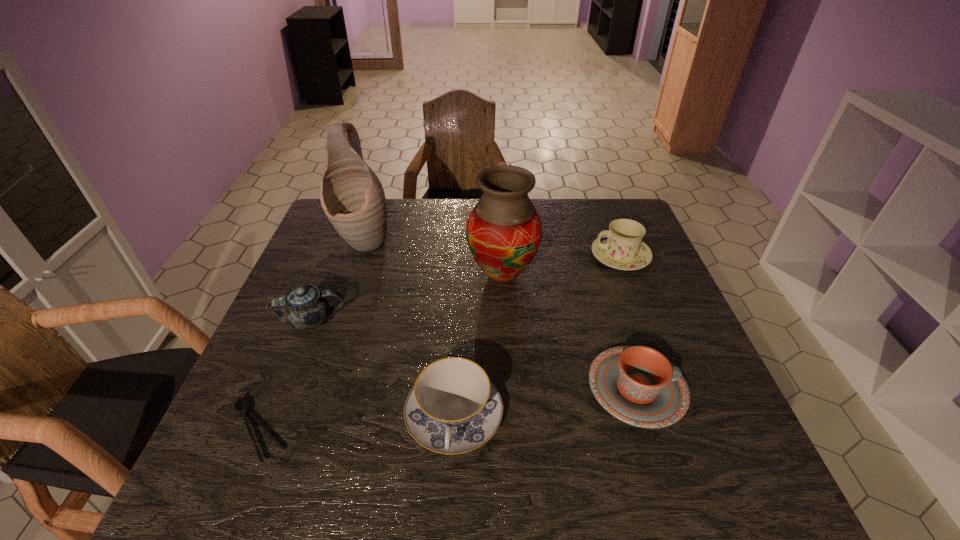
Where is `tongs at the near edge`? Image resolution: width=960 pixels, height=540 pixels. tongs at the near edge is located at coordinates (245, 412).

Find the location of a particular element. The height and width of the screenshot is (540, 960). pitcher located at the left edge is located at coordinates (352, 197).

Where is `chinaware that is at the left edge`? This screenshot has width=960, height=540. chinaware that is at the left edge is located at coordinates [305, 307].

The image size is (960, 540). I want to click on tongs that is positioned at the left edge, so click(245, 412).

I want to click on object at the far left corner, so click(x=352, y=197).

At what (x,y) coordinates should I click in order to perform the action: click on object that is positioned at the near left corner. Please return your answer as a coordinate pair (x, y). This screenshot has width=960, height=540. Looking at the image, I should click on (245, 412).

At what (x,y) coordinates should I click in order to perform the action: click on object that is at the far right corner. Please return your answer as a coordinate pair (x, y). Looking at the image, I should click on (x=621, y=247).

Where is `vacant space at the far edge of the desktop`? Image resolution: width=960 pixels, height=540 pixels. vacant space at the far edge of the desktop is located at coordinates [458, 225].

Image resolution: width=960 pixels, height=540 pixels. I want to click on blank area at the near edge, so click(411, 477).

I want to click on free space at the left edge of the desktop, so click(x=326, y=333).